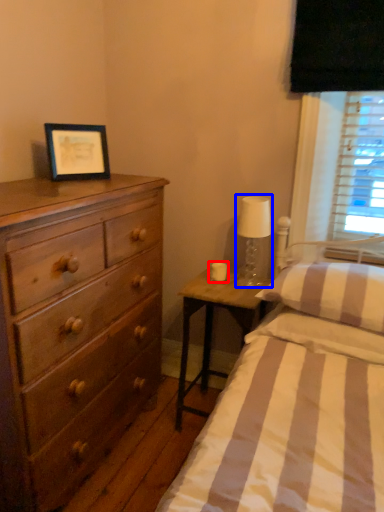
Question: Among these objects, which one is farthest to the camera, candle holder (highlighted by a red box) or bedside lamp (highlighted by a blue box)?

Choices:
 (A) candle holder
 (B) bedside lamp

Answer: (A)